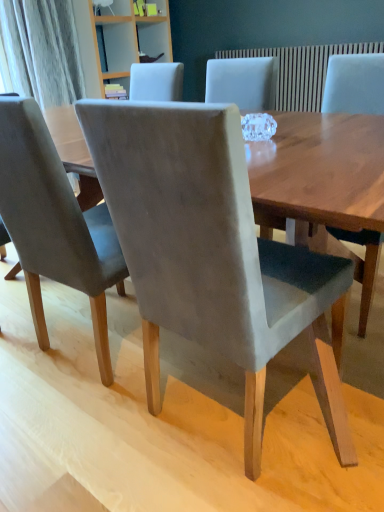
Locate an element on the screen. free space below suede gray chair at center, arranged as the 2th chair when viewed from the right (from a real-world perspective) is located at coordinates (236, 409).